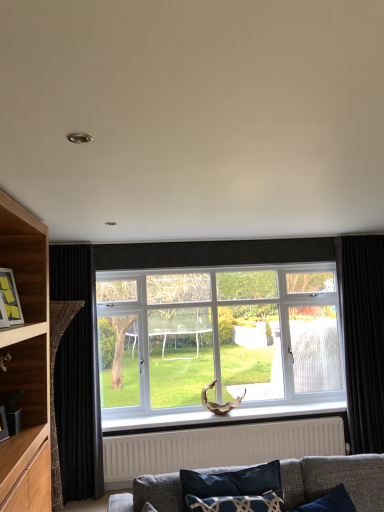
Question: Is wooden frame at left placed right next to black velvet curtain at right, placed as the 1th curtain when sorted from right to left?

Choices:
 (A) yes
 (B) no

Answer: (B)

Question: Is black velvet curtain at right, which ranks as the second curtain in left-to-right order, at the back of wooden frame at left?

Choices:
 (A) no
 (B) yes

Answer: (A)

Question: Could you tell me if wooden frame at left is facing black velvet curtain at right, which ranks as the second curtain in left-to-right order?

Choices:
 (A) yes
 (B) no

Answer: (B)

Question: Is wooden frame at left further to the viewer compared to black velvet curtain at right, which ranks as the second curtain in left-to-right order?

Choices:
 (A) no
 (B) yes

Answer: (A)

Question: Does wooden frame at left appear on the right side of black velvet curtain at right, placed as the 1th curtain when sorted from right to left?

Choices:
 (A) no
 (B) yes

Answer: (A)

Question: Is wooden frame at left positioned in front of black velvet curtain at right, placed as the 1th curtain when sorted from right to left?

Choices:
 (A) no
 (B) yes

Answer: (B)

Question: Is velvet dark blue pillow at lower center thinner than black velvet curtain at right, which ranks as the second curtain in left-to-right order?

Choices:
 (A) no
 (B) yes

Answer: (B)

Question: Could black velvet curtain at right, which ranks as the second curtain in left-to-right order, be considered to be inside velvet dark blue pillow at lower center?

Choices:
 (A) yes
 (B) no

Answer: (B)

Question: From the image's perspective, is velvet dark blue pillow at lower center over black velvet curtain at right, which ranks as the second curtain in left-to-right order?

Choices:
 (A) no
 (B) yes

Answer: (A)

Question: Is velvet dark blue pillow at lower center directly adjacent to black velvet curtain at right, placed as the 1th curtain when sorted from right to left?

Choices:
 (A) yes
 (B) no

Answer: (B)

Question: Considering the relative sizes of velvet dark blue pillow at lower center and black velvet curtain at right, placed as the 1th curtain when sorted from right to left, in the image provided, is velvet dark blue pillow at lower center smaller than black velvet curtain at right, placed as the 1th curtain when sorted from right to left,?

Choices:
 (A) yes
 (B) no

Answer: (A)

Question: Is velvet dark blue pillow at lower center aimed at black velvet curtain at right, which ranks as the second curtain in left-to-right order?

Choices:
 (A) no
 (B) yes

Answer: (A)

Question: Can you confirm if black velvet curtain at right, which ranks as the second curtain in left-to-right order, is taller than white textured radiator at lower center?

Choices:
 (A) no
 (B) yes

Answer: (B)